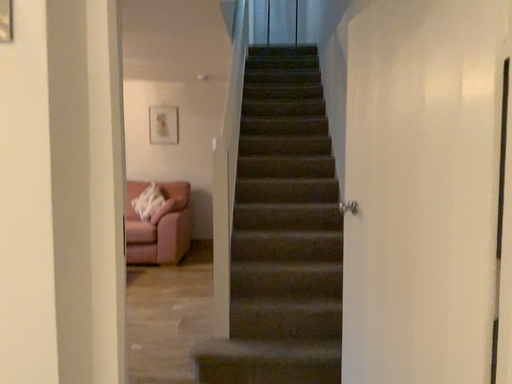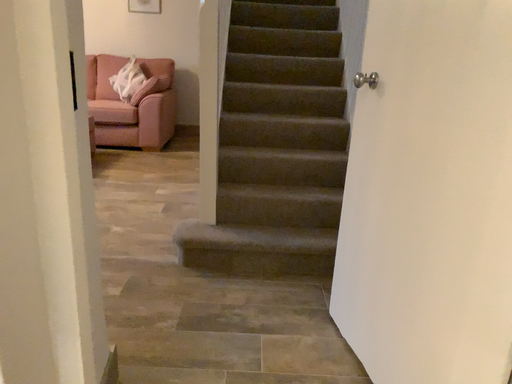
Question: Which way did the camera rotate in the video?

Choices:
 (A) rotated downward
 (B) rotated upward

Answer: (A)